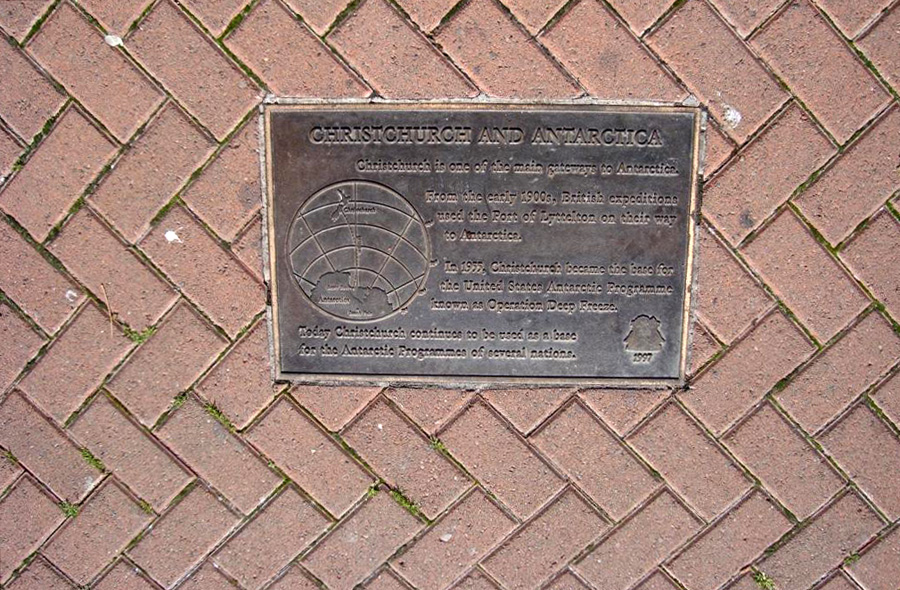
I want to click on placard, so click(537, 198).